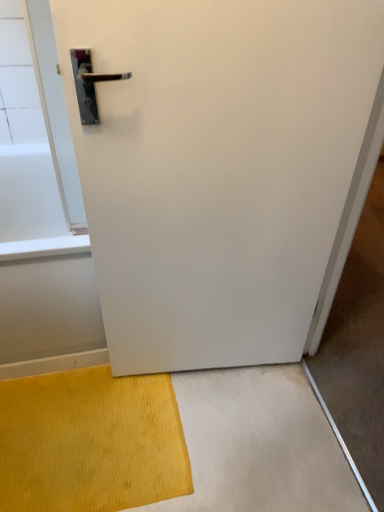
Where is `vacant space underneath white matte door at center (from a real-world perspective)`? vacant space underneath white matte door at center (from a real-world perspective) is located at coordinates (227, 374).